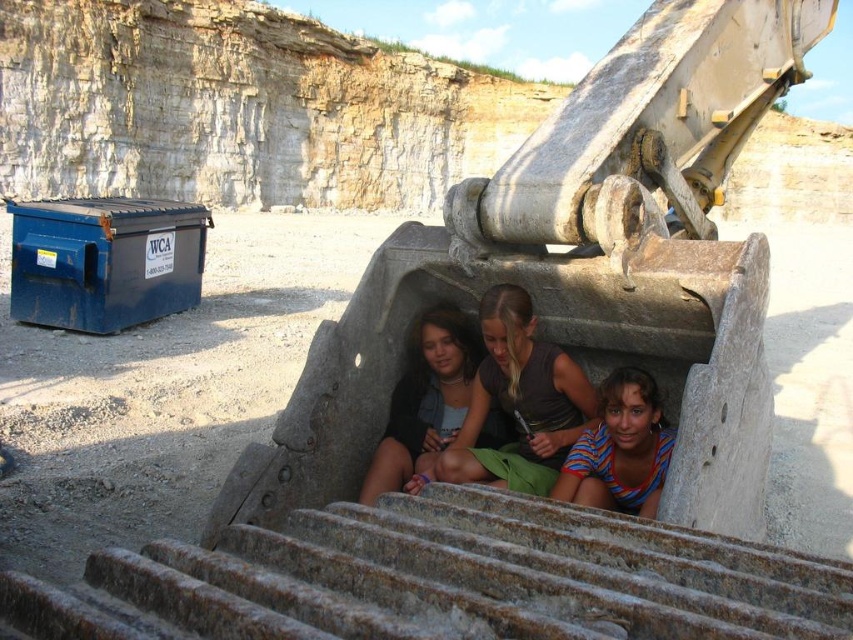
You are standing at the base of the construction site and want to climb up to the excavator bucket where the three people are sitting. The rusty metal stairs at lower center and the matte black shirt at center are in your line of sight. Which object should you approach first to reach the bucket?

You should approach the rusty metal stairs at lower center first because it is closer to the viewer than the matte black shirt at center, making it the more accessible path to the excavator bucket.

You are a safety inspector at the construction site. You notice two items in the excavator bucket area. The rusty metal stairs at lower center and the striped cotton shirt at lower center. According to safety protocols, which item should be removed first to ensure the bucket is cleared for operation?

The rusty metal stairs at lower center should be removed first because it is larger in size than the striped cotton shirt at lower center, making it a bigger obstruction for the bucket operation.